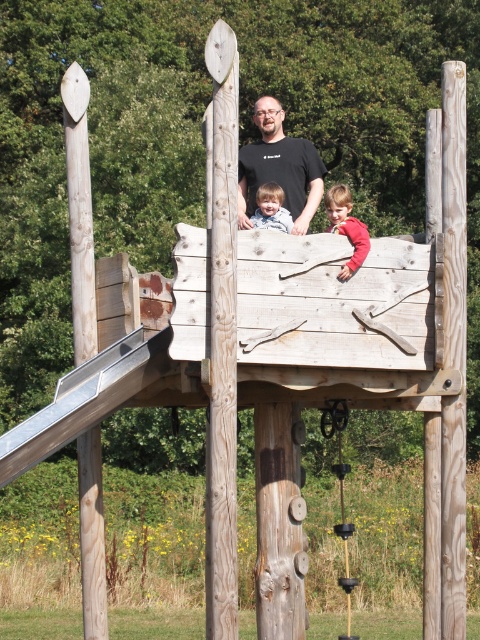
Question: Does matte black shirt at center appear on the right side of matte red shirt at upper center?

Choices:
 (A) no
 (B) yes

Answer: (A)

Question: Which of the following is the farthest from the observer?

Choices:
 (A) (81, 506)
 (B) (339, 452)
 (C) (297, 227)

Answer: (B)

Question: Among these points, which one is farthest from the camera?

Choices:
 (A) (275, 196)
 (B) (95, 308)
 (C) (343, 500)
 (D) (308, 212)

Answer: (C)

Question: Which object appears closest to the camera in this image?

Choices:
 (A) natural wood pole at left
 (B) black plastic swing at center
 (C) natural wood pole at center
 (D) matte black shirt at center

Answer: (C)

Question: Can you confirm if matte red shirt at upper center is smaller than smooth beige shirt at center?

Choices:
 (A) yes
 (B) no

Answer: (B)

Question: Considering the relative positions of black plastic swing at center and smooth beige shirt at center in the image provided, where is black plastic swing at center located with respect to smooth beige shirt at center?

Choices:
 (A) left
 (B) right

Answer: (B)